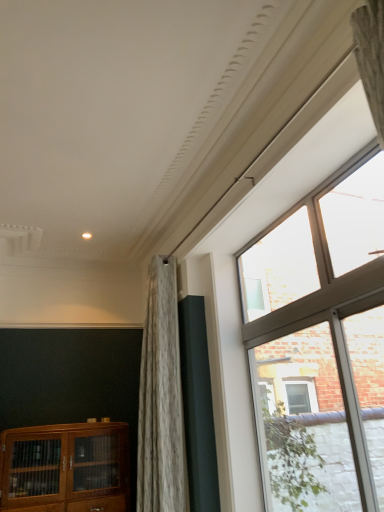
Question: From the image's perspective, relative to clear glass window at upper right, is wooden cabinet at lower left above or below?

Choices:
 (A) above
 (B) below

Answer: (B)

Question: From a real-world perspective, is wooden cabinet at lower left physically located above or below clear glass window at upper right?

Choices:
 (A) below
 (B) above

Answer: (A)

Question: Based on their sizes in the image, would you say wooden cabinet at lower left is bigger or smaller than clear glass window at upper right?

Choices:
 (A) big
 (B) small

Answer: (A)

Question: Is clear glass window at upper right spatially inside wooden cabinet at lower left, or outside of it?

Choices:
 (A) inside
 (B) outside

Answer: (B)

Question: In terms of width, does clear glass window at upper right look wider or thinner when compared to wooden cabinet at lower left?

Choices:
 (A) thin
 (B) wide

Answer: (A)

Question: Is clear glass window at upper right to the left or to the right of wooden cabinet at lower left in the image?

Choices:
 (A) right
 (B) left

Answer: (A)

Question: Is clear glass window at upper right in front of or behind wooden cabinet at lower left in the image?

Choices:
 (A) front
 (B) behind

Answer: (A)